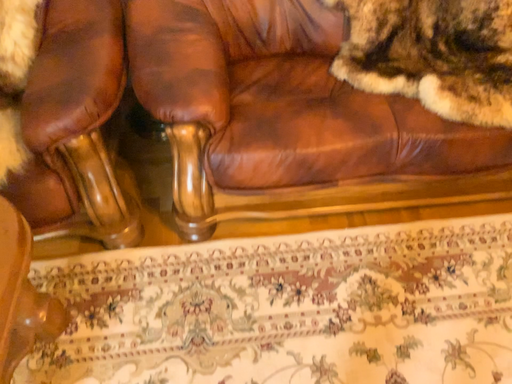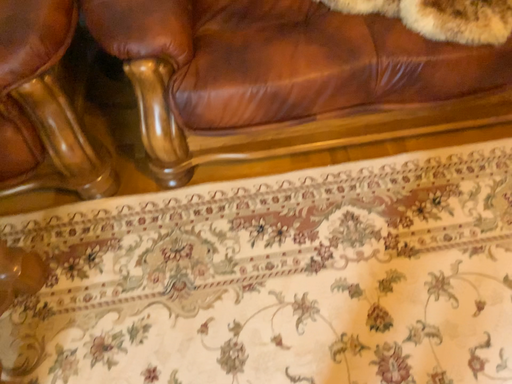
Question: Which way did the camera rotate in the video?

Choices:
 (A) rotated downward
 (B) rotated upward

Answer: (A)